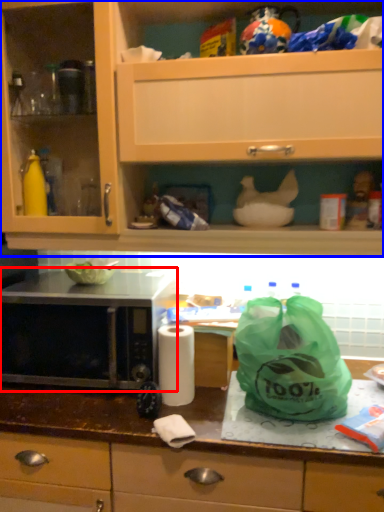
Question: Which object appears closest to the camera in this image, microwave oven (highlighted by a red box) or cabinetry (highlighted by a blue box)?

Choices:
 (A) microwave oven
 (B) cabinetry

Answer: (B)